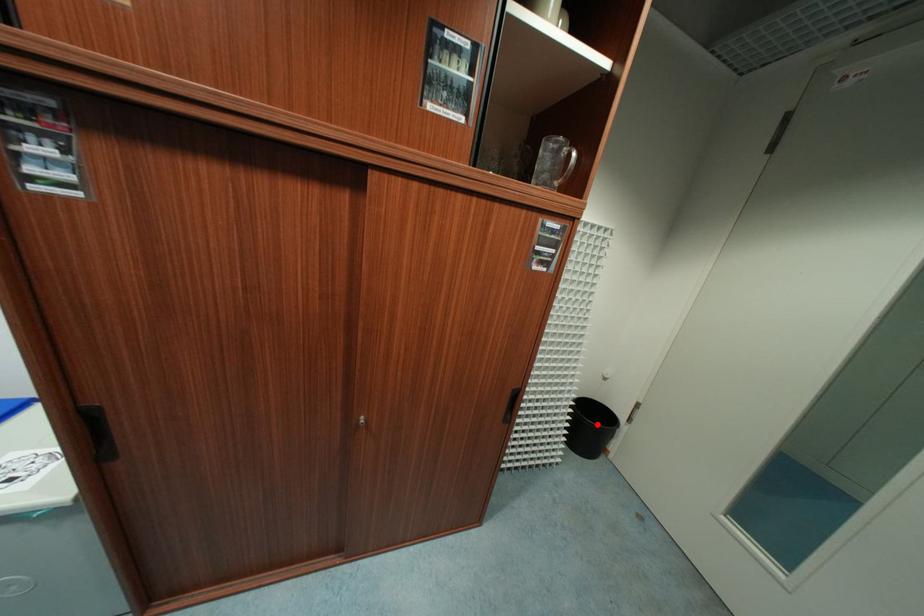
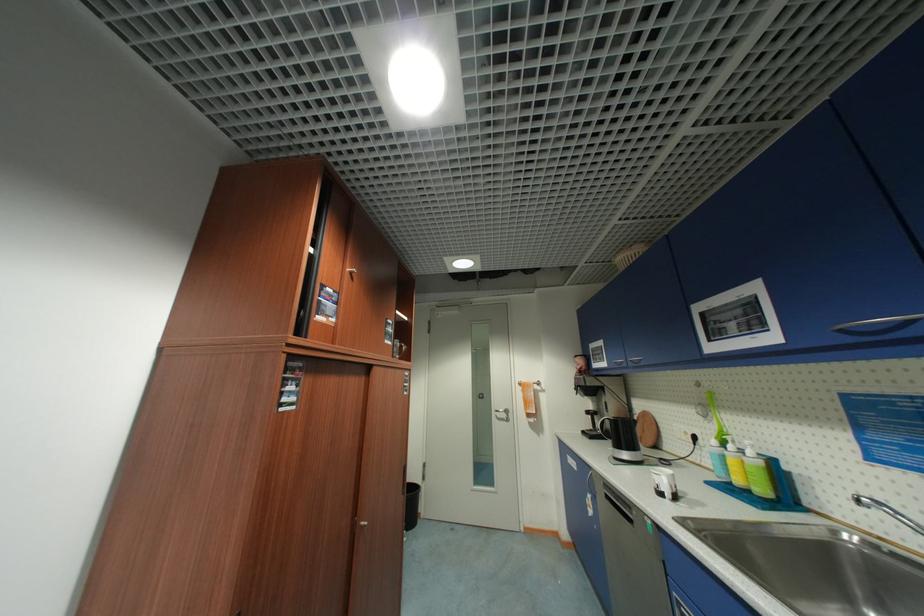
Locate, in the second image, the point that corresponds to the highlighted location in the first image.

(418, 493)